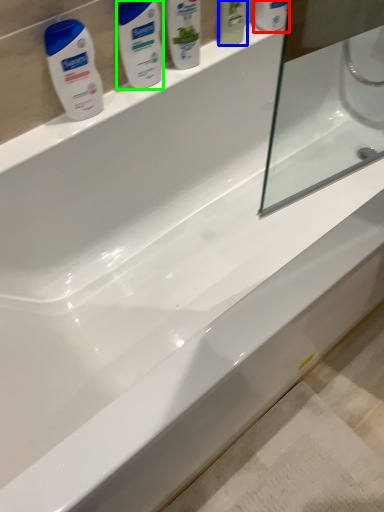
Question: Which object is positioned closest to mouthwash (highlighted by a red box)? Select from mouthwash (highlighted by a blue box) and personal care (highlighted by a green box).

Choices:
 (A) mouthwash
 (B) personal care

Answer: (A)